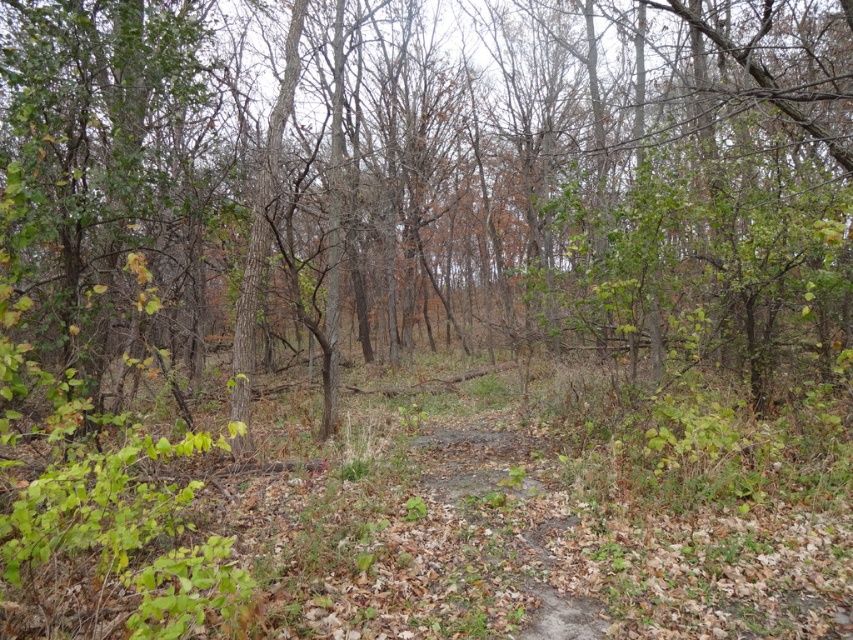
The width and height of the screenshot is (853, 640). What are the coordinates of `brown bark tree at center` in the screenshot? It's located at (425, 173).

Does point (624, 88) lie in front of point (556, 545)?

No, (624, 88) is further to viewer.

Locate an element on the screen. This screenshot has height=640, width=853. brown bark tree at center is located at coordinates click(x=425, y=173).